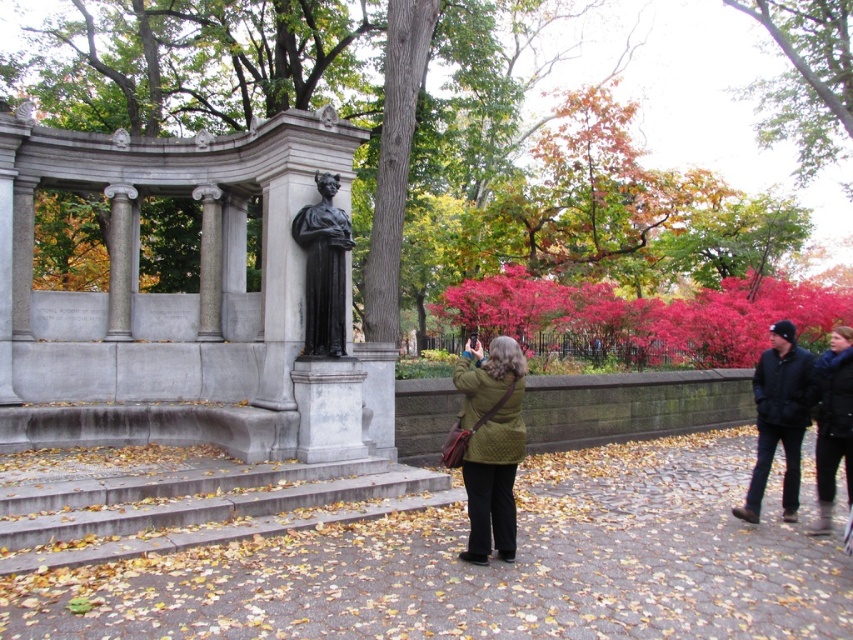
You are standing at the lower center of the image where the gray concrete stairs at lower center are located. If you want to walk towards the monument on the left, which direction should you move relative to the stairs?

Since the monument is on the left side of the image and the gray concrete stairs at lower center are at point (x=196, y=506), you should move to the left relative to the stairs to reach the monument.

You are a photographer trying to capture both the green textured coat at center and the black polished statue at center in a single frame. Based on their sizes, which object should you focus on to ensure both are clearly visible in your photo?

The green textured coat at center is larger than the black polished statue at center, so focusing on the green textured coat at center will help ensure both are clearly visible in the photo.